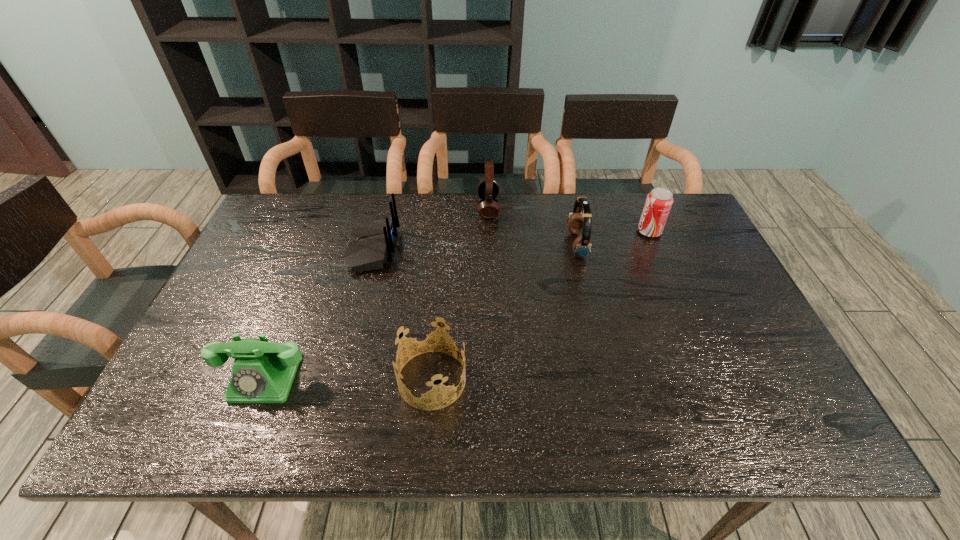
Locate an element on the screen. soda can that is at the far edge is located at coordinates (659, 201).

You are a GUI agent. You are given a task and a screenshot of the screen. Output one action in this format:
    pyautogui.click(x=<x>, y=<y>)
    Task: Click on the router that is at the far edge
    The width and height of the screenshot is (960, 540).
    Given the screenshot: What is the action you would take?
    pyautogui.click(x=371, y=245)

The height and width of the screenshot is (540, 960). In order to click on object that is at the near edge in this screenshot , I will do `click(424, 334)`.

Locate an element on the screen. The width and height of the screenshot is (960, 540). object at the left edge is located at coordinates [263, 372].

Find the location of a particular element. object at the right edge is located at coordinates (659, 201).

Where is `object present at the far right corner`? object present at the far right corner is located at coordinates (659, 201).

In the image, there is a desktop. At what (x,y) coordinates should I click in order to perform the action: click on vacant space at the far edge. Please return your answer as a coordinate pair (x, y). The width and height of the screenshot is (960, 540). Looking at the image, I should click on (500, 227).

The image size is (960, 540). In the image, there is a desktop. Find the location of `vacant space at the left edge`. vacant space at the left edge is located at coordinates (280, 251).

This screenshot has height=540, width=960. Find the location of `free region at the right edge of the desktop`. free region at the right edge of the desktop is located at coordinates (737, 398).

This screenshot has width=960, height=540. In order to click on vacant space at the far left corner of the desktop in this screenshot , I will do `click(301, 205)`.